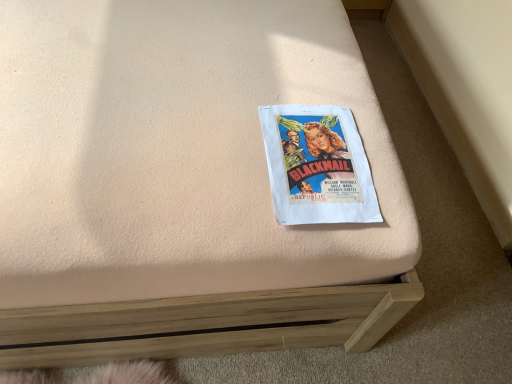
Question: Should I look upward or downward to see matte paper poster at center?

Choices:
 (A) up
 (B) down

Answer: (A)